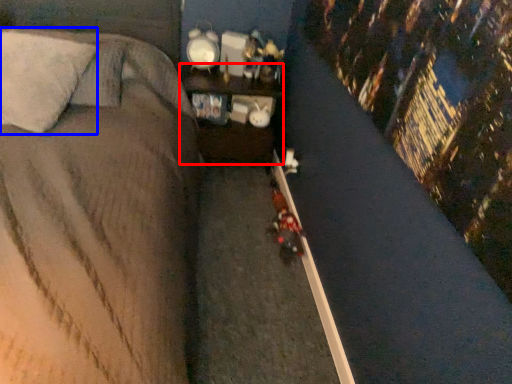
Question: Which object is closer to the camera taking this photo, furniture (highlighted by a red box) or pillow (highlighted by a blue box)?

Choices:
 (A) furniture
 (B) pillow

Answer: (B)